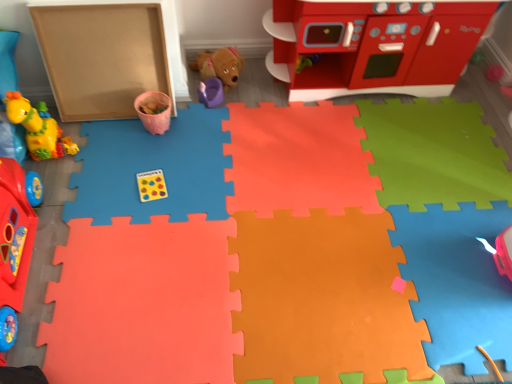
What are the coordinates of `free space in front of purple plastic cup at center, the fourth toy from the left` in the screenshot? It's located at (208, 126).